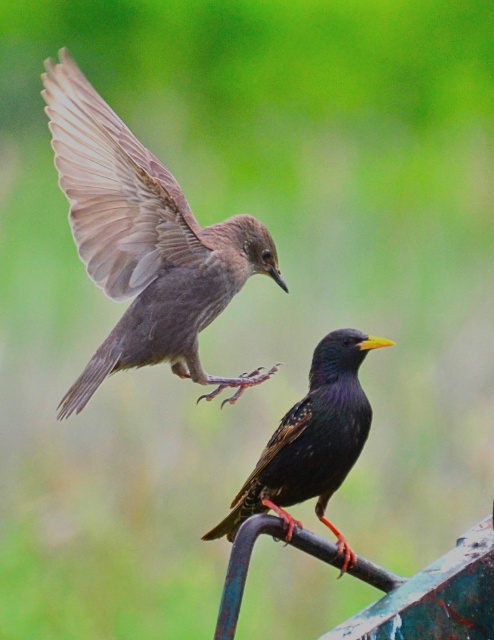
Is point (67, 70) behind point (276, 468)?

That is True.

Is brown feathered wing at upper left to the right of shiny black bird at center from the viewer's perspective?

Incorrect, brown feathered wing at upper left is not on the right side of shiny black bird at center.

Which is behind, point (118, 173) or point (274, 490)?

The point (118, 173) is behind.

I want to click on brown feathered wing at upper left, so click(x=115, y=189).

Is point (97, 100) positioned after point (81, 120)?

That is True.

Does brown feathered bird at upper left have a lesser height compared to brown feathered wing at upper left?

No.

This screenshot has height=640, width=494. In order to click on brown feathered bird at upper left in this screenshot , I will do `click(143, 241)`.

Find the location of a particular element. brown feathered bird at upper left is located at coordinates (143, 241).

Is point (118, 291) positioned before point (312, 435)?

No, (118, 291) is behind (312, 435).

Can you confirm if brown feathered bird at upper left is bigger than shiny black bird at center?

Correct, brown feathered bird at upper left is larger in size than shiny black bird at center.

The height and width of the screenshot is (640, 494). What do you see at coordinates (143, 241) in the screenshot?
I see `brown feathered bird at upper left` at bounding box center [143, 241].

The width and height of the screenshot is (494, 640). Identify the location of brown feathered bird at upper left. (143, 241).